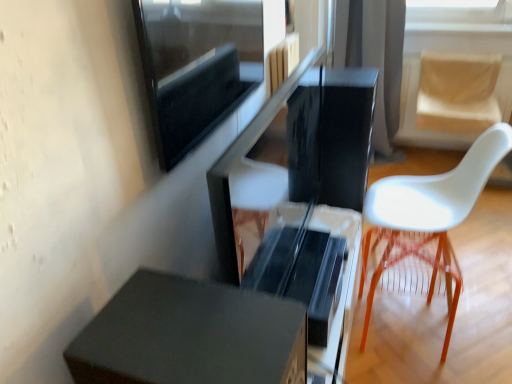
Question: Is white plastic chair at right wider than translucent orange stool at right?

Choices:
 (A) yes
 (B) no

Answer: (A)

Question: Is white plastic chair at right at the left side of translucent orange stool at right?

Choices:
 (A) yes
 (B) no

Answer: (B)

Question: Does white plastic chair at right have a lesser width compared to translucent orange stool at right?

Choices:
 (A) yes
 (B) no

Answer: (B)

Question: From the image's perspective, is white plastic chair at right located beneath translucent orange stool at right?

Choices:
 (A) no
 (B) yes

Answer: (A)

Question: Does white plastic chair at right turn towards translucent orange stool at right?

Choices:
 (A) no
 (B) yes

Answer: (A)

Question: In terms of height, does black fabric curtain at upper center look taller or shorter compared to white plastic chair at right?

Choices:
 (A) short
 (B) tall

Answer: (B)

Question: Is black fabric curtain at upper center inside the boundaries of white plastic chair at right, or outside?

Choices:
 (A) outside
 (B) inside

Answer: (A)

Question: Does point (379, 119) appear closer or farther from the camera than point (461, 286)?

Choices:
 (A) closer
 (B) farther

Answer: (B)

Question: From a real-world perspective, is black fabric curtain at upper center above or below white plastic chair at right?

Choices:
 (A) above
 (B) below

Answer: (A)

Question: Is white plastic chair at right in front of or behind black fabric curtain at upper center in the image?

Choices:
 (A) front
 (B) behind

Answer: (A)

Question: From a real-world perspective, is white plastic chair at right positioned above or below black fabric curtain at upper center?

Choices:
 (A) below
 (B) above

Answer: (A)

Question: From the image's perspective, is white plastic chair at right located above or below black fabric curtain at upper center?

Choices:
 (A) above
 (B) below

Answer: (B)

Question: Is white plastic chair at right wider or thinner than black fabric curtain at upper center?

Choices:
 (A) wide
 (B) thin

Answer: (A)

Question: In the image, is beige fabric swivel chair at right positioned in front of or behind translucent orange stool at right?

Choices:
 (A) front
 (B) behind

Answer: (B)

Question: Considering the relative positions of beige fabric swivel chair at right and translucent orange stool at right in the image provided, is beige fabric swivel chair at right to the left or to the right of translucent orange stool at right?

Choices:
 (A) right
 (B) left

Answer: (A)